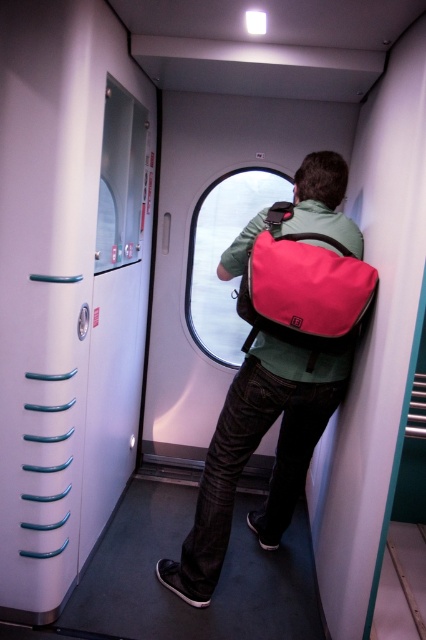
Question: Can you confirm if white plastic door at left is bigger than matte pink backpack at center?

Choices:
 (A) no
 (B) yes

Answer: (B)

Question: Among these objects, which one is nearest to the camera?

Choices:
 (A) white plastic door at left
 (B) matte pink backpack at center
 (C) matte green jacket at center
 (D) white glossy door at left

Answer: (A)

Question: Which of these objects is positioned farthest from the matte pink backpack at center?

Choices:
 (A) white glossy door at left
 (B) white plastic door at left
 (C) matte green jacket at center
 (D) transparent glass window at center

Answer: (D)

Question: Among these objects, which one is nearest to the camera?

Choices:
 (A) matte pink backpack at center
 (B) matte green jacket at center

Answer: (A)

Question: Can you confirm if white plastic door at left is thinner than white glossy door at left?

Choices:
 (A) yes
 (B) no

Answer: (B)

Question: Where is white glossy door at left located in relation to transparent glass window at center in the image?

Choices:
 (A) above
 (B) below

Answer: (B)